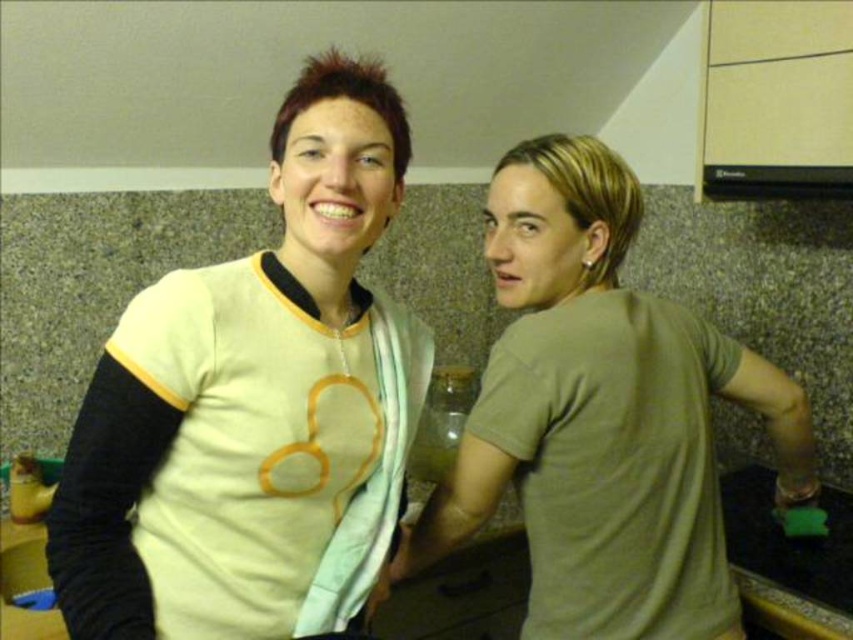
Looking at this image, you are standing in a kitchen and want to reach a point marked at coordinates (434, 502). If you can extend your arm 1.2 meters, will you be able to reach that point?

The point at coordinates (434, 502) is 1.22 meters away from the viewer. Since your arm can only extend 1.2 meters, you will not be able to reach it.